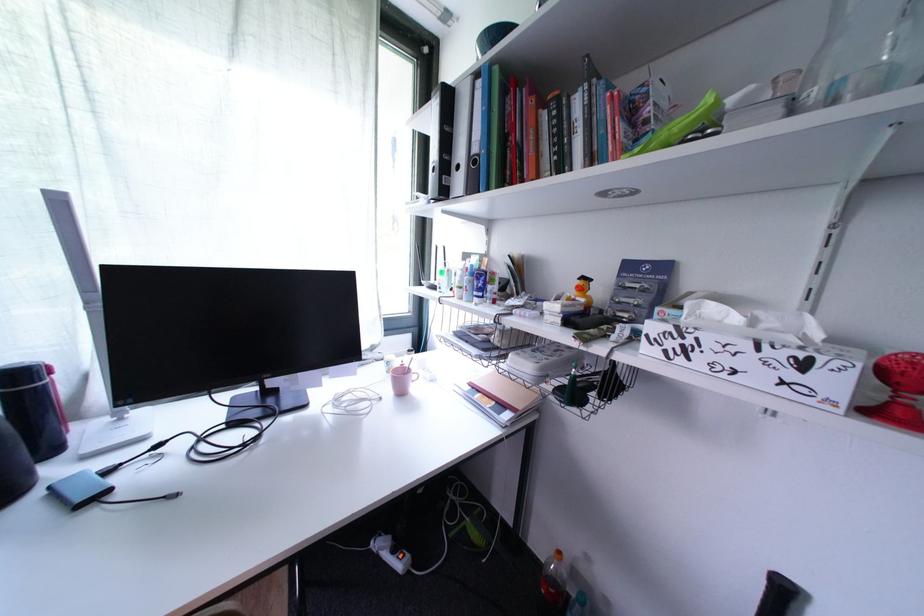
Where would you grasp the pink mug handle? Please return your answer as a coordinate pair (x, y).

(415, 374)